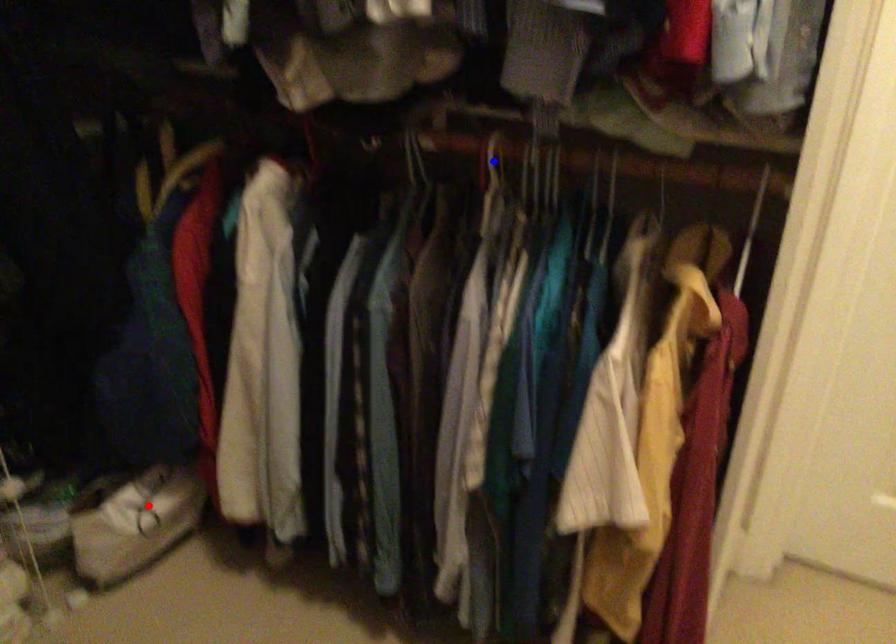
Question: Which of the two points in the image is closer to the camera?

Choices:
 (A) Blue point is closer.
 (B) Red point is closer.

Answer: (A)